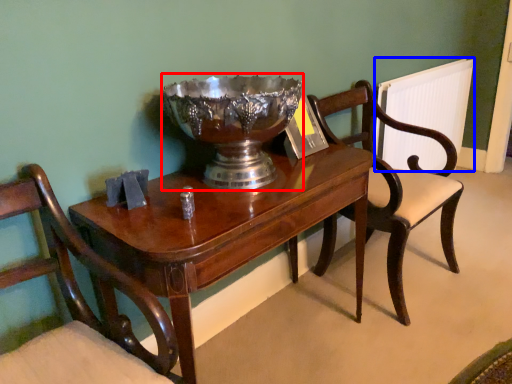
Question: Among these objects, which one is farthest to the camera, bowl (highlighted by a red box) or radiator (highlighted by a blue box)?

Choices:
 (A) bowl
 (B) radiator

Answer: (B)